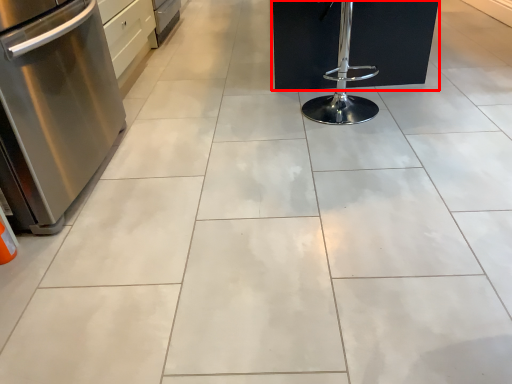
Question: From the image's perspective, where is furniture (annotated by the red box) located in relation to kitchen appliance in the image?

Choices:
 (A) below
 (B) above

Answer: (B)